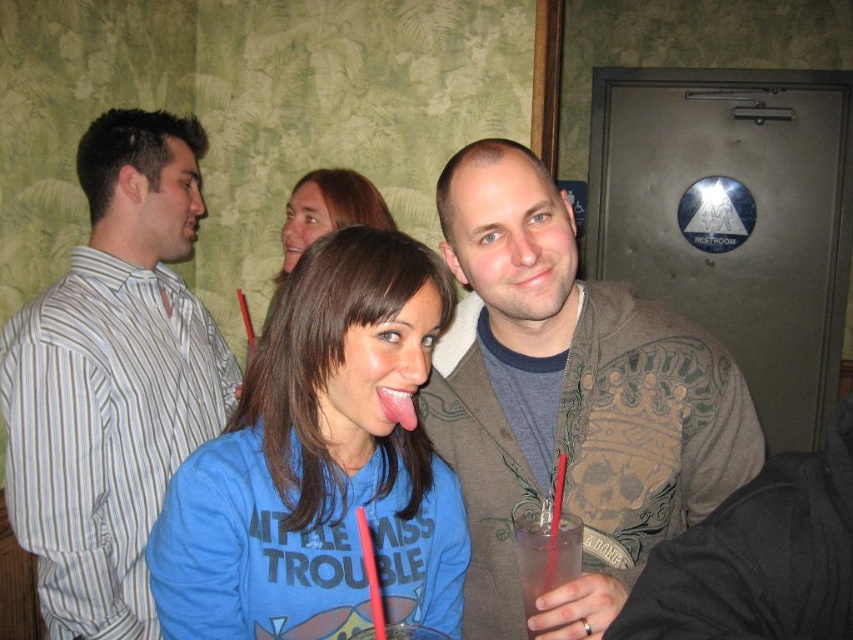
You are standing at the entrance of the bar and want to find the blue cotton shirt at center. According to the coordinates provided, in which direction should you look to locate it?

The blue cotton shirt at center is located at point 0.330 on the x and 0.386 on the y axis, so you should look towards the center of the image to find it.

You are standing in the bar and want to move from point A to point B. Point A is at coordinates point (56, 432) and point B is at coordinates point (401, 388). Which point is closer to you?

Point A at coordinates point (56, 432) is closer to you since it is further to the viewer than point B at coordinates point (401, 388).

You are a bartender and need to reach the clear plastic cup at center to refill it. Is the blue cotton shirt at center blocking your access to it?

The blue cotton shirt at center is positioned over the clear plastic cup at center, so yes, the blue cotton shirt at center is blocking access to the clear plastic cup at center.